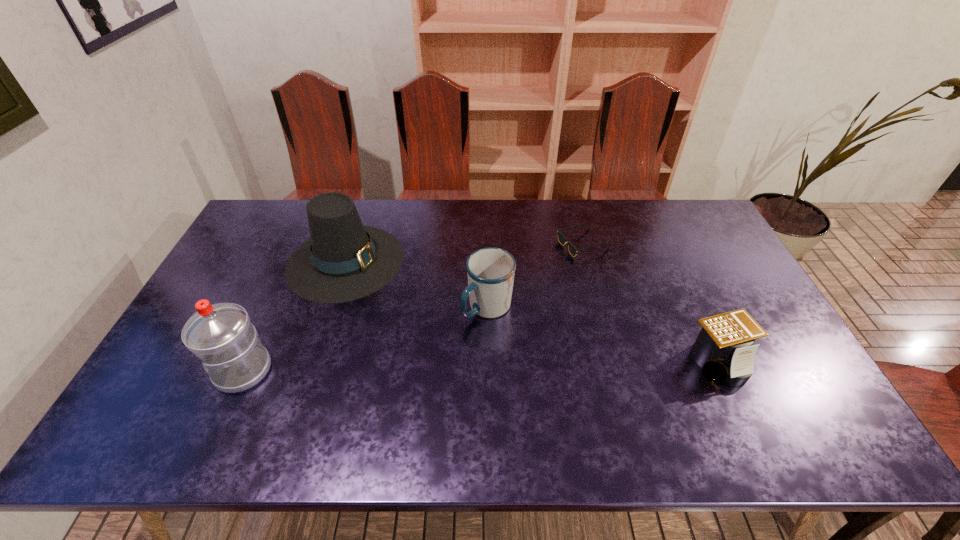
Find the location of a particular element. This screenshot has width=960, height=540. water bottle is located at coordinates [221, 335].

Find the location of `calculator`. calculator is located at coordinates (723, 349).

Locate an element on the screen. The height and width of the screenshot is (540, 960). the rightmost object is located at coordinates (723, 349).

This screenshot has height=540, width=960. What are the coordinates of `the shortest object` in the screenshot? It's located at (562, 239).

At what (x,y) coordinates should I click in order to perform the action: click on the fourth object from left to right. Please return your answer as a coordinate pair (x, y). The height and width of the screenshot is (540, 960). Looking at the image, I should click on (562, 239).

Image resolution: width=960 pixels, height=540 pixels. I want to click on mug, so click(490, 271).

Locate an element on the screen. The image size is (960, 540). the third tallest object is located at coordinates (490, 271).

Find the location of a particular element. hat is located at coordinates (343, 260).

Where is `free region located on the handle side of the water bottle`? The image size is (960, 540). free region located on the handle side of the water bottle is located at coordinates (177, 370).

The height and width of the screenshot is (540, 960). I want to click on free space located 0.210m on the back of the rightmost object, so click(682, 285).